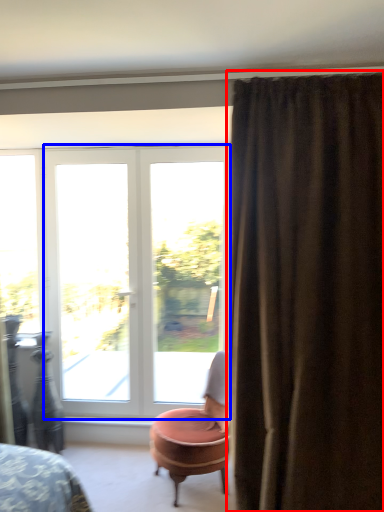
Question: Which object is further to the camera taking this photo, curtain (highlighted by a red box) or door (highlighted by a blue box)?

Choices:
 (A) curtain
 (B) door

Answer: (B)